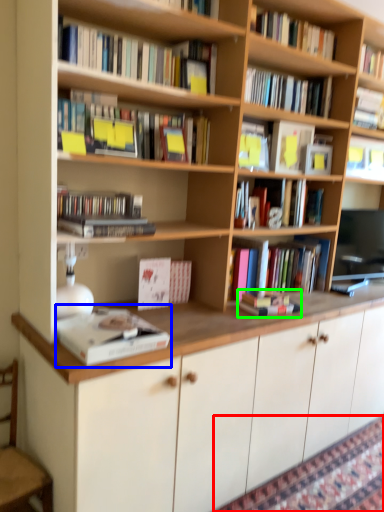
Question: Estimate the real-world distances between objects in this image. Which object is closer to mat (highlighted by a red box), book (highlighted by a blue box) or book (highlighted by a green box)?

Choices:
 (A) book
 (B) book

Answer: (B)